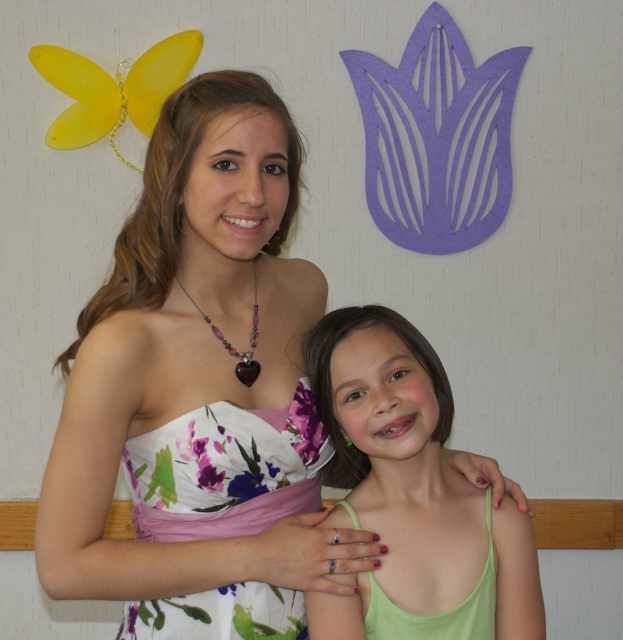
Where is `white floral dress at center`? Image resolution: width=623 pixels, height=640 pixels. white floral dress at center is located at coordinates (201, 392).

The width and height of the screenshot is (623, 640). In order to click on white floral dress at center in this screenshot , I will do `click(201, 392)`.

Where is `white floral dress at center`? This screenshot has height=640, width=623. white floral dress at center is located at coordinates (201, 392).

Consider the image. Does white floral dress at center have a lesser height compared to green matte tank top at center?

No, white floral dress at center is not shorter than green matte tank top at center.

Does white floral dress at center appear on the right side of green matte tank top at center?

Incorrect, white floral dress at center is not on the right side of green matte tank top at center.

Does point (295, 532) come in front of point (394, 397)?

Yes, it is.

Identify the location of white floral dress at center. (201, 392).

From the picture: Does white floral dress at center appear on the right side of green fabric dress at lower center?

No, white floral dress at center is not to the right of green fabric dress at lower center.

Which is in front, point (282, 429) or point (368, 609)?

Positioned in front is point (282, 429).

Does point (270, 394) come behind point (371, 636)?

No, it is not.

Where is `white floral dress at center`? The height and width of the screenshot is (640, 623). white floral dress at center is located at coordinates (201, 392).